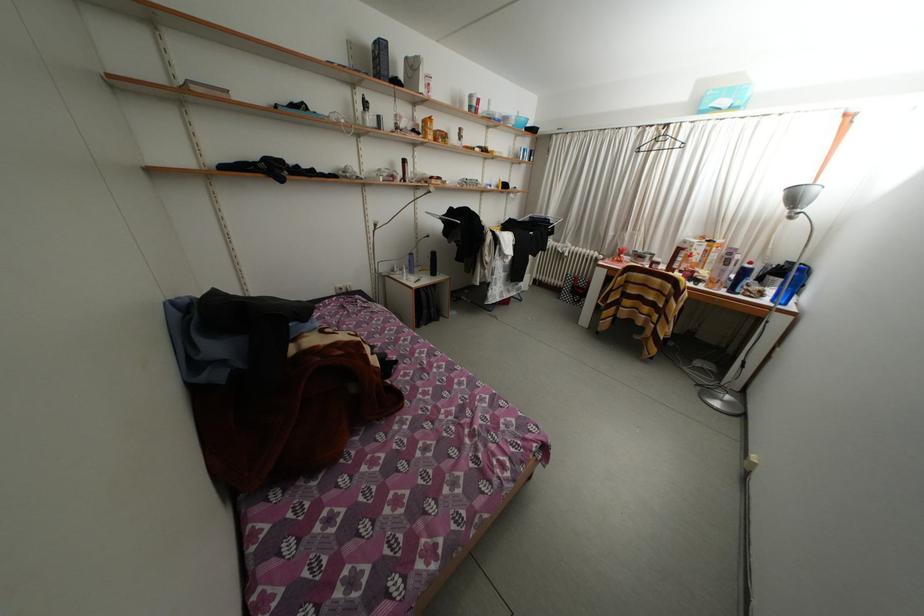
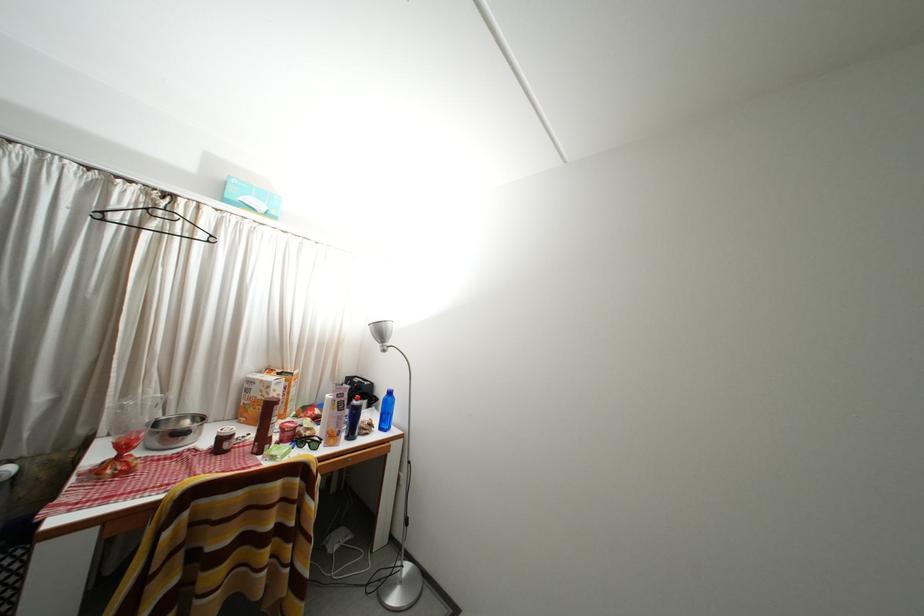
Find the pixel in the second image that matches the point at 664,152 in the first image.

(161, 230)